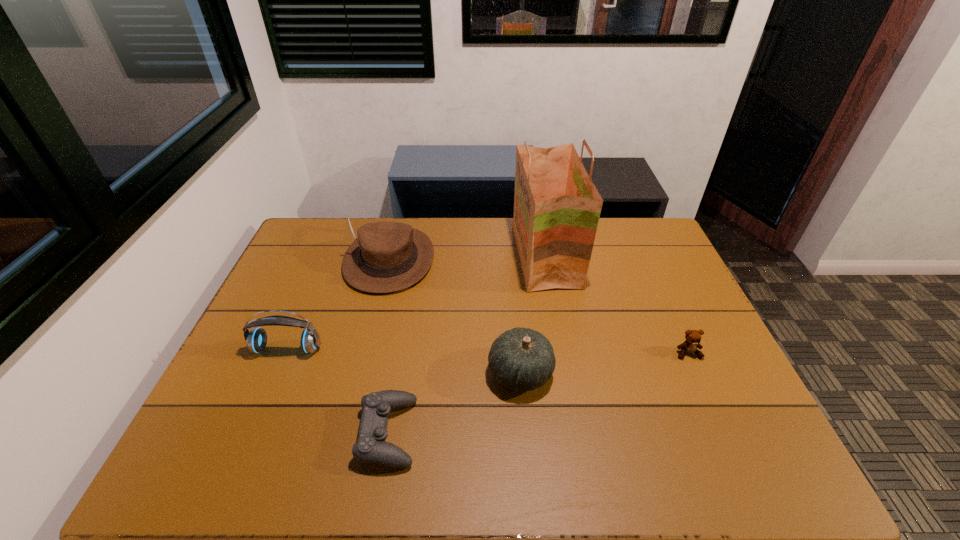
Locate an element on the screen. the tallest object is located at coordinates pyautogui.click(x=557, y=207).

At what (x,y) coordinates should I click in order to perform the action: click on the second tallest object. Please return your answer as a coordinate pair (x, y). This screenshot has height=540, width=960. Looking at the image, I should click on (386, 257).

Find the location of a particular element. Image resolution: width=960 pixels, height=540 pixels. gourd is located at coordinates point(522,359).

Locate an element on the screen. Image resolution: width=960 pixels, height=540 pixels. headset is located at coordinates (256, 339).

Where is `teddy bear`? The width and height of the screenshot is (960, 540). teddy bear is located at coordinates (693, 337).

At what (x,y) coordinates should I click in order to perform the action: click on the fifth tallest object. Please return your answer as a coordinate pair (x, y). The image size is (960, 540). Looking at the image, I should click on coord(693,337).

This screenshot has height=540, width=960. Identify the location of the shortest object. (371, 447).

This screenshot has width=960, height=540. Identify the location of vacant area located 0.380m on the left of the grocery bag. (403, 256).

This screenshot has width=960, height=540. What are the coordinates of `vacant space located on the feather side of the fedora` in the screenshot? It's located at click(x=375, y=315).

This screenshot has height=540, width=960. I want to click on free point located 0.300m on the right of the gourd, so click(x=668, y=372).